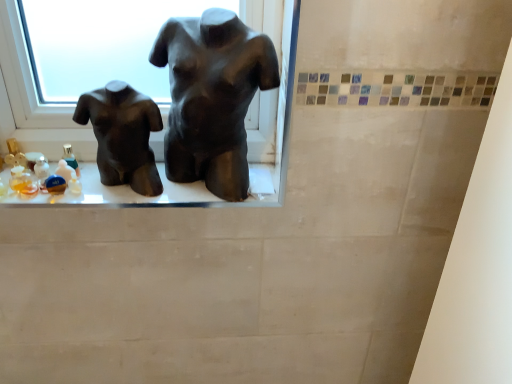
Question: Is point (215, 203) positioned closer to the camera than point (126, 147)?

Choices:
 (A) farther
 (B) closer

Answer: (A)

Question: From the image's perspective, relative to matte black torso at left, which appears as the first statue (sculpture) when viewed from the left, is matte black mannequin torso at center above or below?

Choices:
 (A) below
 (B) above

Answer: (A)

Question: Based on their relative distances, which object is farther from the matte black mannequin torso at center?

Choices:
 (A) matte black torso at left, which appears as the first statue (sculpture) when viewed from the left
 (B) matte black torso at center, the 2th statue (sculpture) from the left

Answer: (B)

Question: Based on their relative distances, which object is farther from the matte black torso at left, which ranks as the 2th statue (sculpture) in right-to-left order?

Choices:
 (A) matte black torso at center, the 2th statue (sculpture) from the left
 (B) matte black mannequin torso at center

Answer: (A)